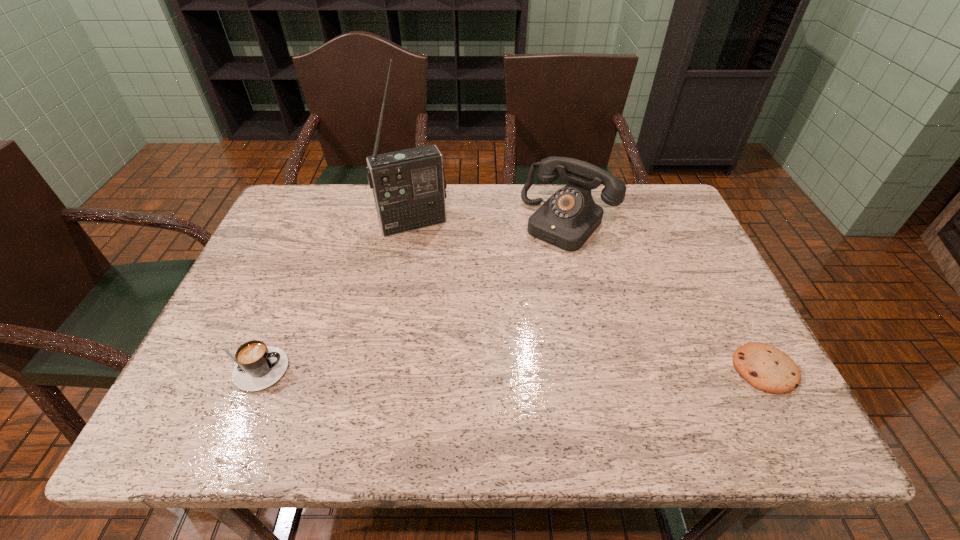
Locate an element on the screen. This screenshot has height=540, width=960. vacant space situated 0.150m on the dial of the second tallest object is located at coordinates (516, 278).

I want to click on vacant area situated on the dial of the second tallest object, so click(x=520, y=273).

Locate an element on the screen. The width and height of the screenshot is (960, 540). blank area located 0.120m on the dial of the second tallest object is located at coordinates (523, 271).

The height and width of the screenshot is (540, 960). In order to click on vacant space situated 0.320m on the display of the tallest object in this screenshot , I will do `click(463, 319)`.

At what (x,y) coordinates should I click in order to perform the action: click on vacant space located on the display of the tallest object. Please return your answer as a coordinate pair (x, y). Looking at the image, I should click on (448, 287).

You are a GUI agent. You are given a task and a screenshot of the screen. Output one action in this format:
    pyautogui.click(x=<x>, y=<y>)
    Task: Click on the free space located 0.130m on the display of the tallest object
    Image resolution: width=960 pixels, height=540 pixels.
    Given the screenshot: What is the action you would take?
    pyautogui.click(x=439, y=266)

Identify the location of telephone that is at the far edge. This screenshot has height=540, width=960. (568, 218).

Find the location of a particular element. Image resolution: width=960 pixels, height=540 pixels. radio receiver that is at the far edge is located at coordinates (409, 186).

What are the coordinates of `cappuccino at the near edge` in the screenshot? It's located at (258, 366).

You are a GUI agent. You are given a task and a screenshot of the screen. Output one action in this format:
    pyautogui.click(x=<x>, y=<y>)
    Task: Click on the cookie that is at the near edge
    The image size is (960, 540).
    Given the screenshot: What is the action you would take?
    tap(766, 368)